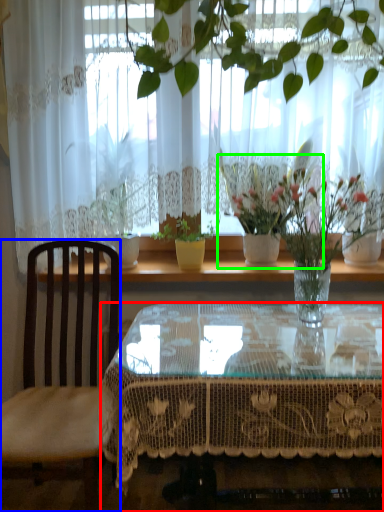
Question: Which is nearer to the coffee table (highlighted by a red box)? chair (highlighted by a blue box) or houseplant (highlighted by a green box).

Choices:
 (A) chair
 (B) houseplant

Answer: (A)